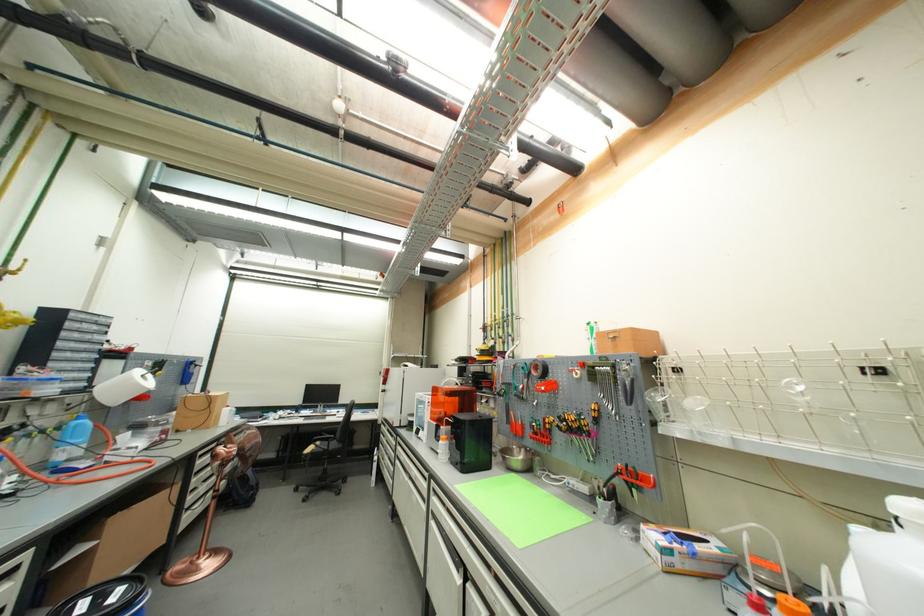
What do you see at coordinates (331, 480) in the screenshot? The height and width of the screenshot is (616, 924). I see `a chair sitting surface` at bounding box center [331, 480].